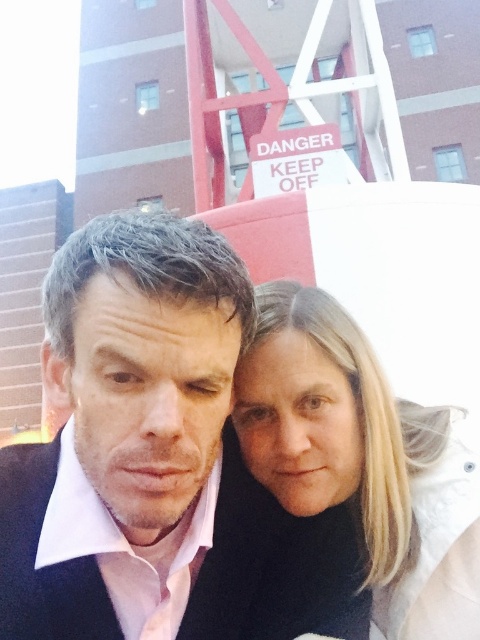
Image resolution: width=480 pixels, height=640 pixels. Find the location of `pink matte shirt at center`. pink matte shirt at center is located at coordinates (157, 461).

This screenshot has height=640, width=480. I want to click on pink matte shirt at center, so 157,461.

Does blonde hair at center have a smaller size compared to black matte business suit at center?

No, blonde hair at center is not smaller than black matte business suit at center.

Is blonde hair at center thinner than black matte business suit at center?

Correct, blonde hair at center's width is less than black matte business suit at center's.

What do you see at coordinates (362, 461) in the screenshot? The width and height of the screenshot is (480, 640). I see `blonde hair at center` at bounding box center [362, 461].

I want to click on blonde hair at center, so click(x=362, y=461).

Who is shorter, pink matte shirt at center or blonde hair at center?

blonde hair at center is shorter.

How far apart are pink matte shirt at center and blonde hair at center?

The distance of pink matte shirt at center from blonde hair at center is 2.30 meters.

Is point (168, 460) behind point (463, 500)?

No, (168, 460) is closer to viewer.

Locate an element on the screen. Image resolution: width=480 pixels, height=640 pixels. pink matte shirt at center is located at coordinates (157, 461).